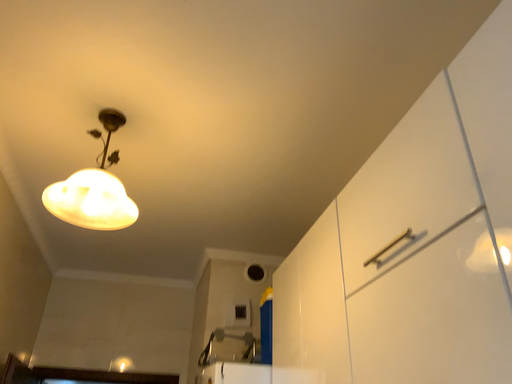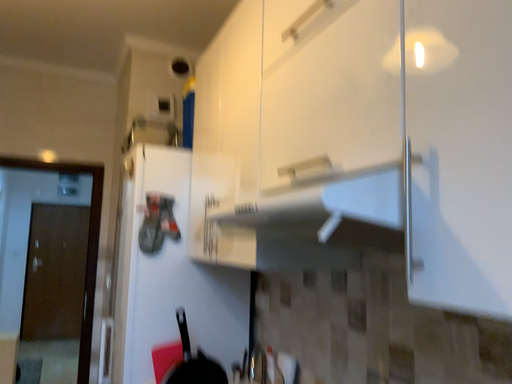
Question: How did the camera likely rotate when shooting the video?

Choices:
 (A) rotated downward
 (B) rotated upward

Answer: (A)